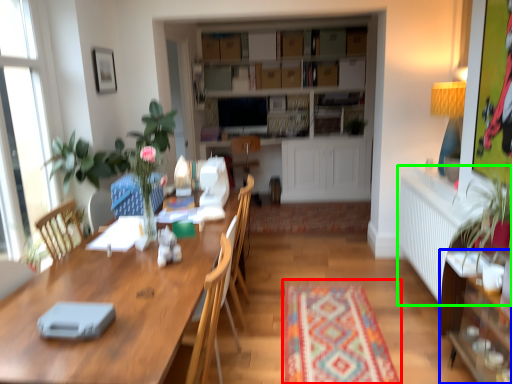
Question: Based on their relative distances, which object is nearer to mat (highlighted by a red box)? Choose from cabinetry (highlighted by a blue box) and radiator (highlighted by a green box).

Choices:
 (A) cabinetry
 (B) radiator

Answer: (A)